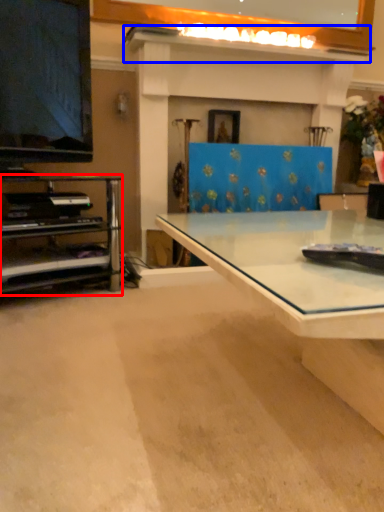
Question: Which point is closer to the camera, shelf (highlighted by a red box) or mantle (highlighted by a blue box)?

Choices:
 (A) shelf
 (B) mantle

Answer: (A)